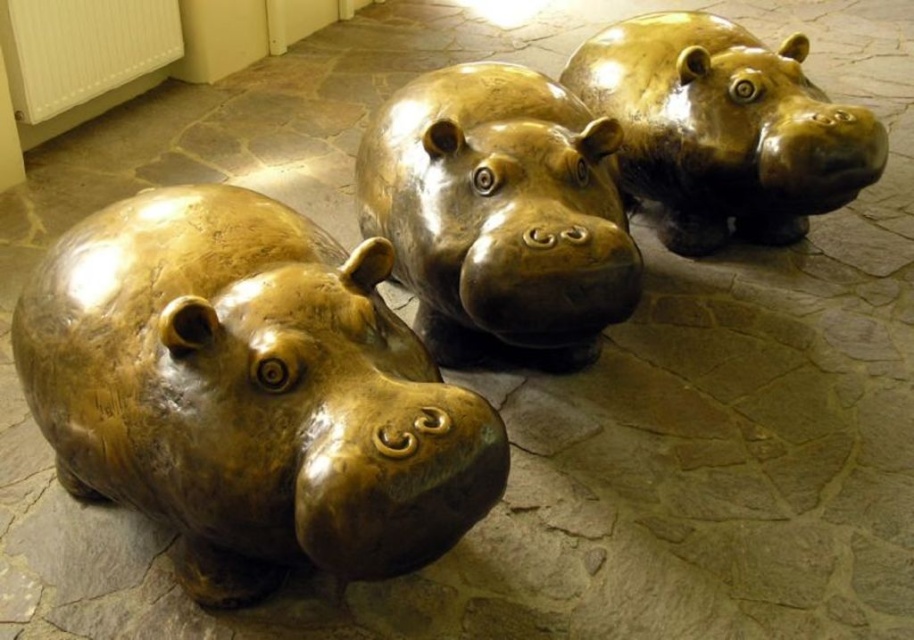
Who is positioned more to the right, gold-bronze hippo at left or gold polished hippo at center?

gold polished hippo at center

Looking at this image, does gold-bronze hippo at left come in front of gold polished hippo at center?

That is True.

Is point (158, 490) farther from viewer compared to point (601, 320)?

No, it is in front of (601, 320).

Identify the location of gold-bronze hippo at left. This screenshot has width=914, height=640. (250, 392).

Which is behind, point (465, 301) or point (843, 193)?

The point (843, 193) is behind.

Is point (443, 266) more distant than point (760, 154)?

No, (443, 266) is in front of (760, 154).

Find the location of a particular element. gold polished hippo at center is located at coordinates (498, 214).

Does gold-bronze hippo at left come behind gold polished hippo at upper right?

No, it is in front of gold polished hippo at upper right.

Is gold-bronze hippo at left above gold polished hippo at upper right?

No, gold-bronze hippo at left is not above gold polished hippo at upper right.

Is point (256, 550) in front of point (769, 125)?

Yes, it is.

The width and height of the screenshot is (914, 640). In order to click on gold-bronze hippo at left in this screenshot , I will do `click(250, 392)`.